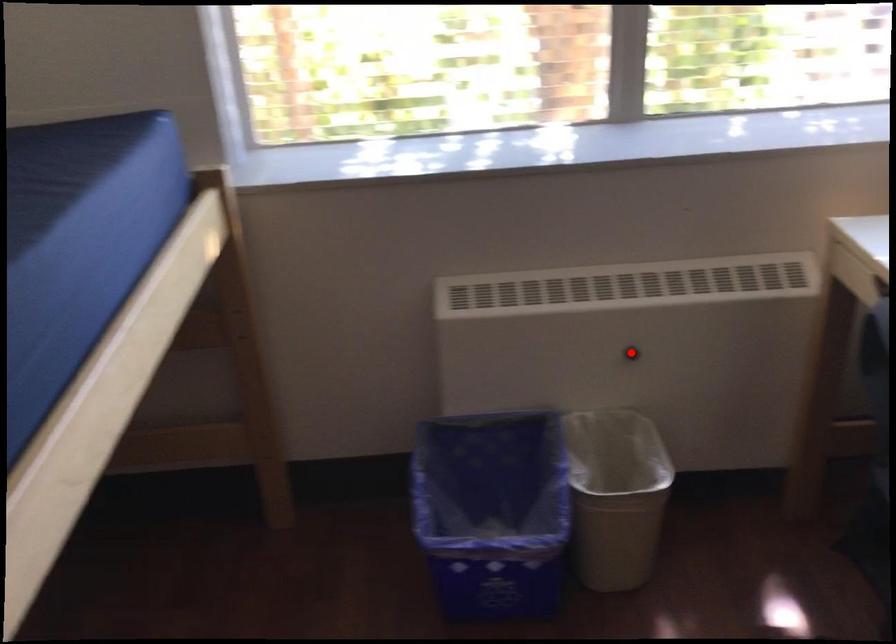
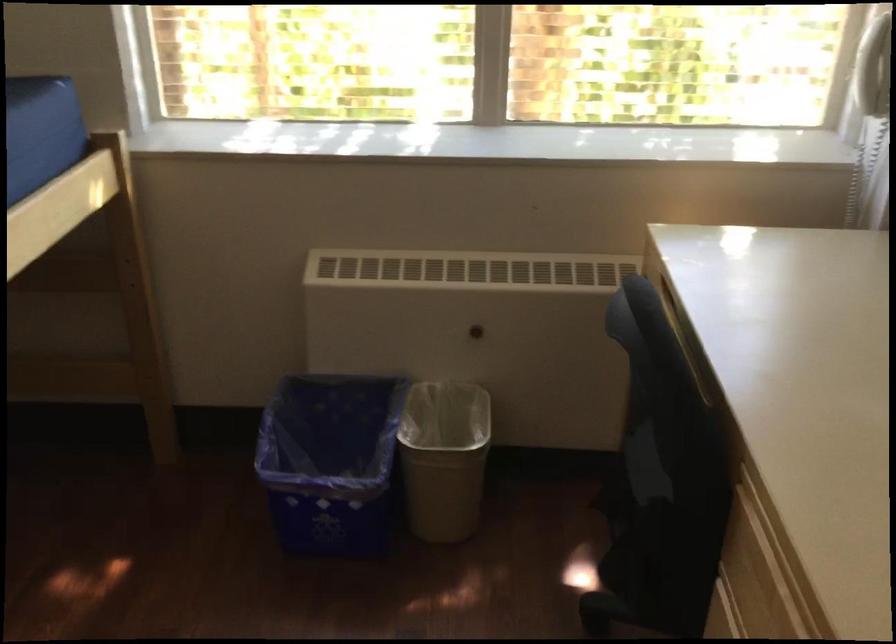
Where in the second image is the point corresponding to the highlighted location from the first image?

(476, 330)